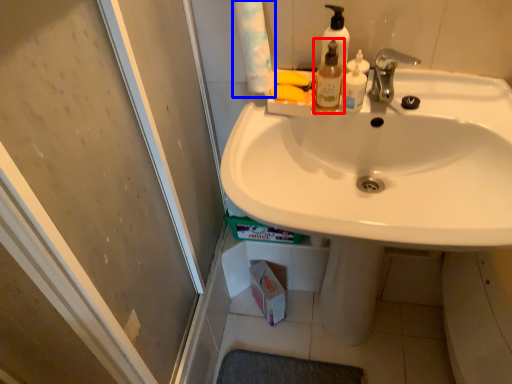
Question: Which object appears farthest to the camera in this image, mouthwash (highlighted by a red box) or toilet paper (highlighted by a blue box)?

Choices:
 (A) mouthwash
 (B) toilet paper

Answer: (A)